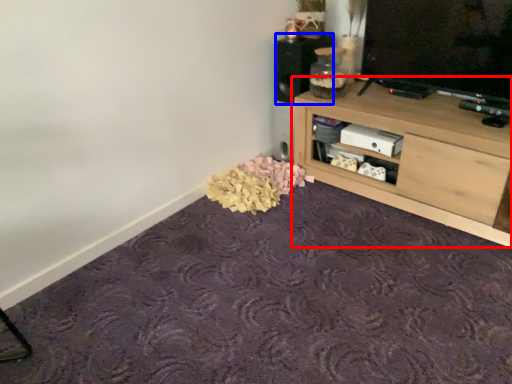
Question: Which object is further to the camera taking this photo, shelf (highlighted by a red box) or speaker (highlighted by a blue box)?

Choices:
 (A) shelf
 (B) speaker

Answer: (B)